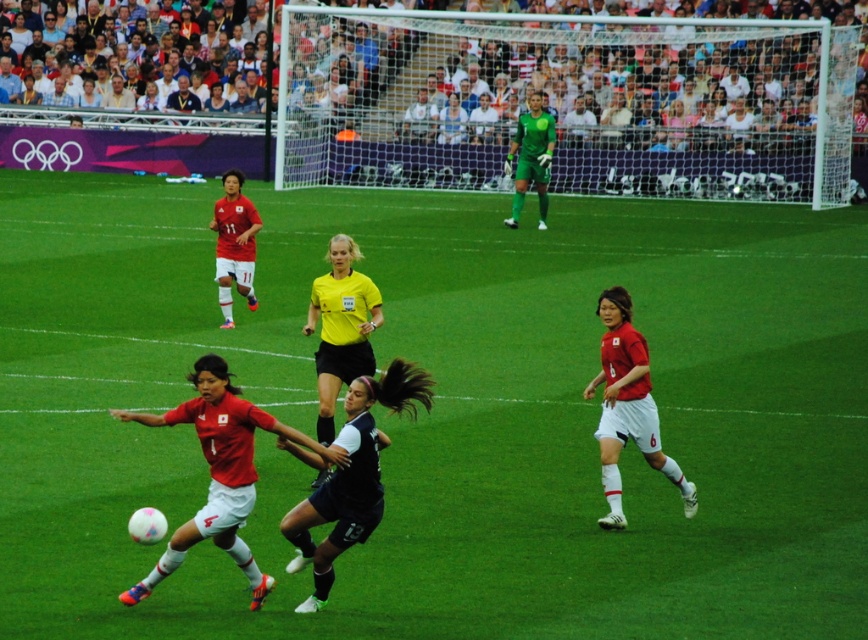
Question: Among these objects, which one is nearest to the camera?

Choices:
 (A) white mesh net at center
 (B) green grass football field at center
 (C) black jersey at center

Answer: (B)

Question: From the image, what is the correct spatial relationship of green grass football field at center in relation to matte red jersey at right?

Choices:
 (A) right
 (B) left

Answer: (B)

Question: Which object is the closest to the matte red jersey at center?

Choices:
 (A) dark blue jersey at center
 (B) white mesh net at center

Answer: (A)

Question: Which object is the closest to the matte red jersey at center?

Choices:
 (A) black jersey at center
 (B) matte red jersey at right
 (C) green grass football field at center
 (D) dark blue jersey at center

Answer: (D)

Question: Can you confirm if green grass football field at center is smaller than matte red jersey at right?

Choices:
 (A) no
 (B) yes

Answer: (A)

Question: From the image, what is the correct spatial relationship of matte red jersey at center in relation to dark blue jersey at center?

Choices:
 (A) above
 (B) below

Answer: (B)